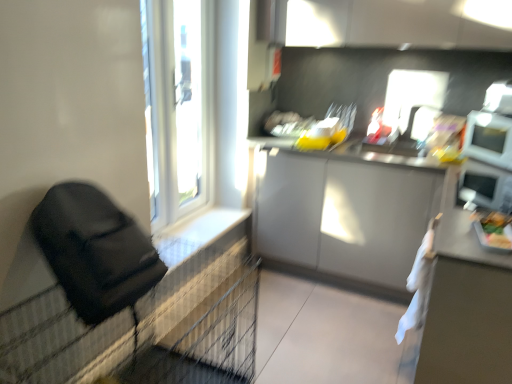
Where is `white plastic window frame at upper left`? white plastic window frame at upper left is located at coordinates (188, 102).

This screenshot has width=512, height=384. What do you see at coordinates (196, 106) in the screenshot?
I see `white plastic window at upper left` at bounding box center [196, 106].

What do you see at coordinates (467, 310) in the screenshot? I see `white matte table at right` at bounding box center [467, 310].

The height and width of the screenshot is (384, 512). What do you see at coordinates (202, 233) in the screenshot?
I see `white textured tile at lower left` at bounding box center [202, 233].

The height and width of the screenshot is (384, 512). What do you see at coordinates (95, 252) in the screenshot?
I see `black leather bag at left` at bounding box center [95, 252].

What do you see at coordinates (489, 139) in the screenshot? I see `white glossy microwave at upper right` at bounding box center [489, 139].

Describe the element at coordinates (497, 230) in the screenshot. I see `green matte tray at right` at that location.

Locate an element on the screen. The height and width of the screenshot is (384, 512). white plastic window frame at upper left is located at coordinates (188, 102).

Is white plastic window frame at upper left not within green matte tray at right?

Yes.

Is white plastic window frame at upper left positioned far away from green matte tray at right?

white plastic window frame at upper left is positioned a significant distance from green matte tray at right.

Is white plastic window frame at upper left positioned with its back to green matte tray at right?

No, white plastic window frame at upper left is not facing the opposite direction of green matte tray at right.

Between white plastic window at upper left and white plastic window frame at upper left, which one is positioned behind?

white plastic window frame at upper left is further from the camera.

Are white plastic window at upper left and white plastic window frame at upper left far apart?

No, white plastic window at upper left is in close proximity to white plastic window frame at upper left.

Does point (170, 6) come in front of point (191, 66)?

Yes.

The image size is (512, 384). Find the location of `window sill that is on the left side of green matte tray at right`. window sill that is on the left side of green matte tray at right is located at coordinates 202,233.

Is white textured tile at lower left bigger than green matte tray at right?

Correct, white textured tile at lower left is larger in size than green matte tray at right.

Who is taller, white textured tile at lower left or green matte tray at right?

green matte tray at right is taller.

Is white textured tile at lower left closer to camera compared to green matte tray at right?

No, the depth of white textured tile at lower left is greater than that of green matte tray at right.

From the picture: Is white glossy microwave at upper right bigger or smaller than white plastic window frame at upper left?

Considering their sizes, white glossy microwave at upper right takes up less space than white plastic window frame at upper left.

Find the location of a particular element. window frame to the left of white glossy microwave at upper right is located at coordinates (188, 102).

Is white plastic window frame at upper left at the back of white glossy microwave at upper right?

No, white plastic window frame at upper left is not at the back of white glossy microwave at upper right.

Considering the sizes of objects white glossy microwave at upper right and white plastic window frame at upper left in the image provided, who is shorter, white glossy microwave at upper right or white plastic window frame at upper left?

white glossy microwave at upper right.

Who is bigger, white plastic window at upper left or white matte table at right?

Bigger between the two is white matte table at right.

Does white plastic window at upper left turn towards white matte table at right?

Yes, white plastic window at upper left is facing white matte table at right.

Find the location of a particular element. The width and height of the screenshot is (512, 384). window on the left of white matte table at right is located at coordinates (196, 106).

From a real-world perspective, who is located higher, white plastic window at upper left or white matte table at right?

white plastic window at upper left, from a real-world perspective.

Considering the positions of objects white plastic window frame at upper left and white glossy microwave at upper right in the image provided, who is in front, white plastic window frame at upper left or white glossy microwave at upper right?

white glossy microwave at upper right is in front.

How many degrees apart are the facing directions of white plastic window frame at upper left and white glossy microwave at upper right?

The angle between the facing direction of white plastic window frame at upper left and the facing direction of white glossy microwave at upper right is 140 degrees.

Considering the positions of points (198, 7) and (509, 166), is point (198, 7) closer to camera compared to point (509, 166)?

No, (198, 7) is behind (509, 166).

From the picture: Does white plastic window frame at upper left turn towards white glossy microwave at upper right?

No, white plastic window frame at upper left is not facing towards white glossy microwave at upper right.

Which of these two, black leather bag at left or white glossy microwave at upper right, is smaller?

white glossy microwave at upper right.

Is point (68, 186) closer to viewer compared to point (490, 132)?

Yes, point (68, 186) is in front of point (490, 132).

Based on the photo, is black leather bag at left situated inside white glossy microwave at upper right or outside?

black leather bag at left lies outside white glossy microwave at upper right.

Looking at this image, is black leather bag at left next to white glossy microwave at upper right and touching it?

black leather bag at left and white glossy microwave at upper right are clearly separated.

Identify the location of window frame on the left of green matte tray at right. This screenshot has width=512, height=384. (188, 102).

Image resolution: width=512 pixels, height=384 pixels. Find the location of `window frame above the white plastic window at upper left (from the image's perspective)`. window frame above the white plastic window at upper left (from the image's perspective) is located at coordinates (188, 102).

Considering their positions, is white plastic window at upper left positioned closer to white textured tile at lower left than white matte table at right?

Based on the image, white plastic window at upper left appears to be nearer to white textured tile at lower left.

Estimate the real-world distances between objects in this image. Which object is further from white textured tile at lower left, white glossy microwave at upper right or white plastic window at upper left?

white glossy microwave at upper right is further to white textured tile at lower left.

Looking at the image, which one is located closer to black leather bag at left, white glossy microwave at upper right or green matte tray at right?

Among the two, green matte tray at right is located nearer to black leather bag at left.

Based on their spatial positions, is white plastic window at upper left or white matte table at right closer to white plastic window frame at upper left?

white plastic window at upper left.

Which object lies further to the anchor point white matte table at right, white glossy microwave at upper right or green matte tray at right?

white glossy microwave at upper right is further to white matte table at right.

Which object lies further to the anchor point white glossy microwave at upper right, white textured tile at lower left or white plastic window frame at upper left?

Among the two, white plastic window frame at upper left is located further to white glossy microwave at upper right.

Which object lies nearer to the anchor point white matte table at right, white plastic window at upper left or white plastic window frame at upper left?

white plastic window at upper left.

When comparing their distances from white plastic window at upper left, does white plastic window frame at upper left or green matte tray at right seem further?

green matte tray at right lies further to white plastic window at upper left than the other object.

Where is `table between black leather bag at left and white glossy microwave at upper right`? The height and width of the screenshot is (384, 512). table between black leather bag at left and white glossy microwave at upper right is located at coordinates (467, 310).

You are a GUI agent. You are given a task and a screenshot of the screen. Output one action in this format:
    pyautogui.click(x=<x>, y=<y>)
    Task: Click on the window frame situated between black leather bag at left and white matte table at right from left to right
    Image resolution: width=512 pixels, height=384 pixels.
    Given the screenshot: What is the action you would take?
    pyautogui.click(x=188, y=102)

The height and width of the screenshot is (384, 512). What are the coordinates of `window that lies between white plastic window frame at upper left and white textured tile at lower left from top to bottom` in the screenshot? It's located at (196, 106).

Where is `window sill between white plastic window frame at upper left and green matte tray at right in the horizontal direction`? window sill between white plastic window frame at upper left and green matte tray at right in the horizontal direction is located at coordinates (202, 233).